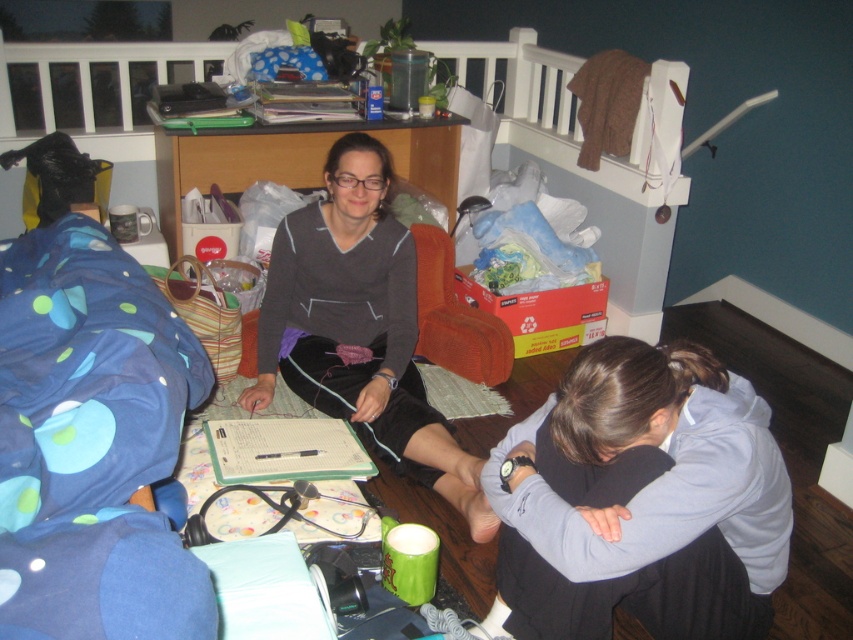
You are organizing a charity clothing drive and need to determine which items can fit into a donation box that has a minimum size requirement of 1 meter in length. Based on the scene, can the gray fleece hoodie at lower right and the matte gray sweater at center meet this requirement?

The gray fleece hoodie at lower right has a smaller size compared to matte gray sweater at center. However, neither item is explicitly stated to be 1 meter in length, so it cannot be determined if they meet the requirement based on the provided information.

You are organizing a laundry day and need to sort the gray fleece hoodie at lower right and the matte gray sweater at center. Which one is positioned more to the east in the room?

The gray fleece hoodie at lower right is positioned to the right of the matte gray sweater at center, so it is more to the east in the room.

You are a delivery person who needs to place a small package between the gray fleece hoodie at lower right and the matte gray sweater at center. Can you fit the package between them?

The gray fleece hoodie at lower right is in front of the matte gray sweater at center, so there is space between them to fit the package.